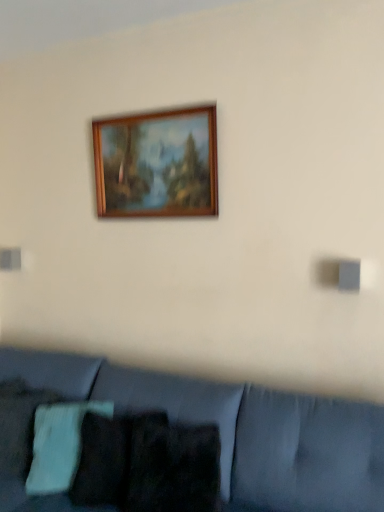
Question: In the image, is velvet blue couch at lower center on the left side or the right side of green knitted pillow at lower left?

Choices:
 (A) left
 (B) right

Answer: (B)

Question: Choose the correct answer: Is velvet blue couch at lower center inside green knitted pillow at lower left or outside it?

Choices:
 (A) inside
 (B) outside

Answer: (B)

Question: Estimate the real-world distances between objects in this image. Which object is closer to the velvet blue couch at lower center?

Choices:
 (A) wooden frame at upper center
 (B) green knitted pillow at lower left

Answer: (B)

Question: Considering the real-world distances, which object is closest to the wooden frame at upper center?

Choices:
 (A) green knitted pillow at lower left
 (B) velvet blue couch at lower center

Answer: (B)